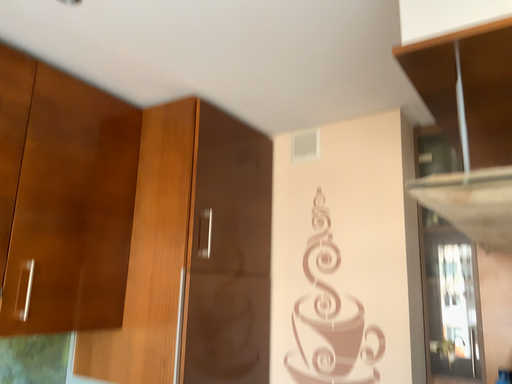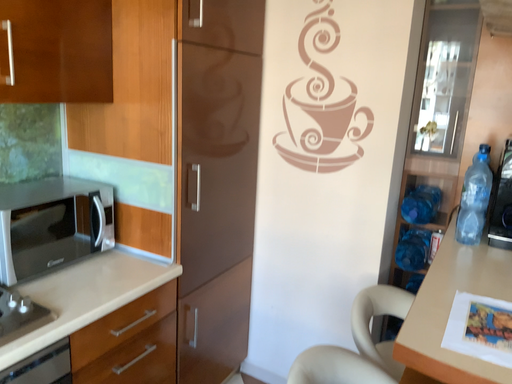
Question: How did the camera likely rotate when shooting the video?

Choices:
 (A) rotated downward
 (B) rotated upward

Answer: (A)